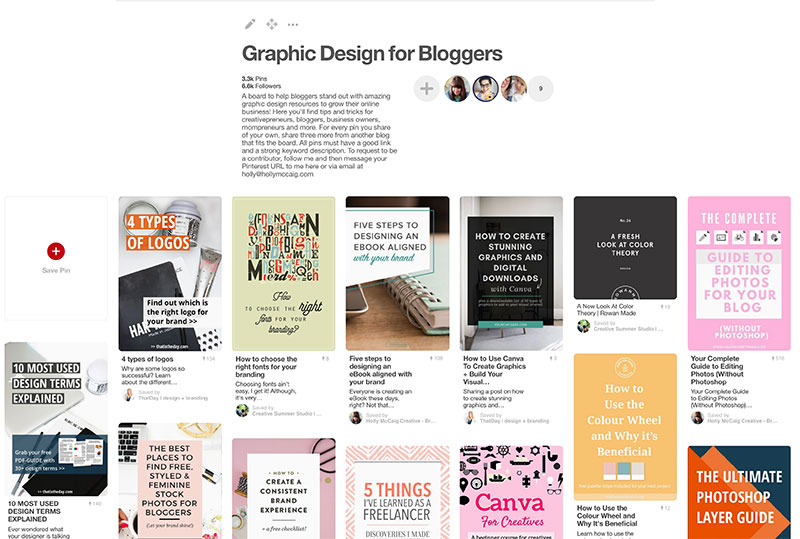
Locate an element on the screen. table is located at coordinates coord(386,322).